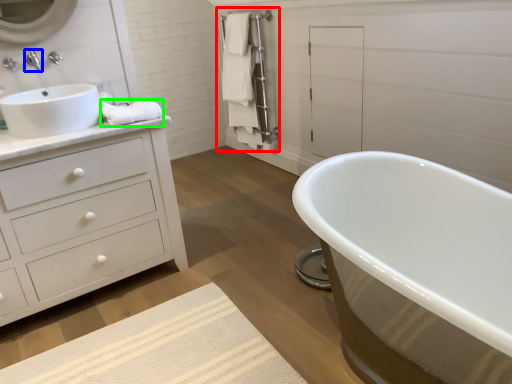
Question: Based on their relative distances, which object is nearer to closet (highlighted by a red box)? Choose from tap (highlighted by a blue box) and material (highlighted by a green box).

Choices:
 (A) tap
 (B) material

Answer: (B)